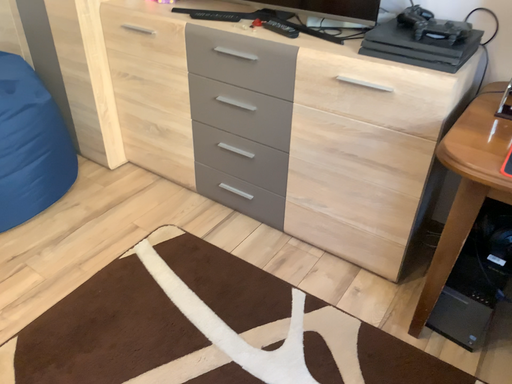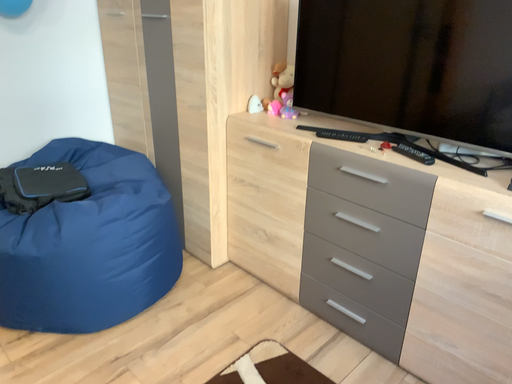
Question: Which way did the camera rotate in the video?

Choices:
 (A) rotated upward
 (B) rotated downward

Answer: (A)